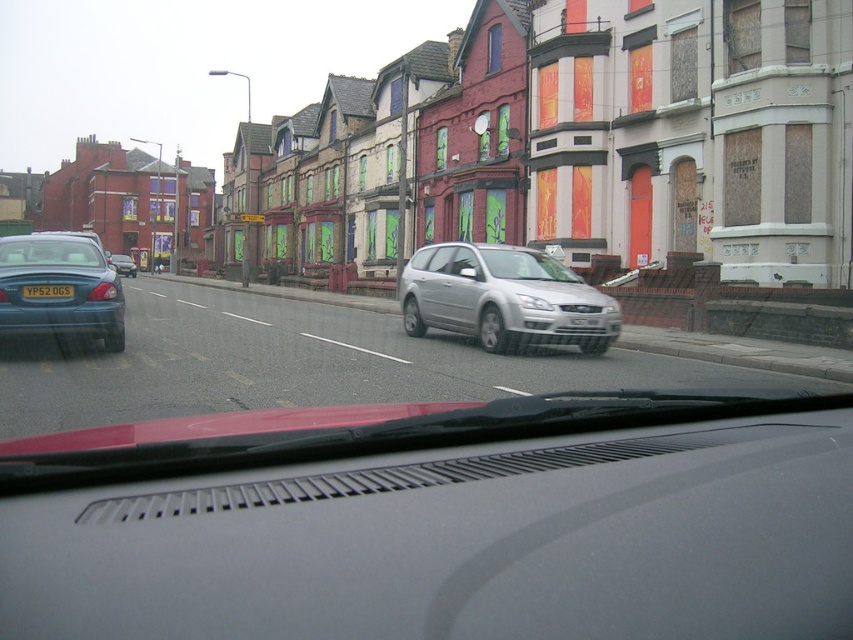
Question: Does gray matte dashboard at center appear on the left side of satin silver car at center?

Choices:
 (A) no
 (B) yes

Answer: (B)

Question: Which object is farther from the camera taking this photo?

Choices:
 (A) black plastic license plate at center
 (B) silver metallic station wagon at center

Answer: (B)

Question: Does black plastic license plate at center appear on the right side of metallic blue sedan at center?

Choices:
 (A) no
 (B) yes

Answer: (B)

Question: Which point is farther to the camera?

Choices:
 (A) (103, 324)
 (B) (67, 241)
 (C) (614, 326)
 (D) (543, 260)

Answer: (D)

Question: Among these objects, which one is farthest from the camera?

Choices:
 (A) satin silver car at center
 (B) gray matte dashboard at center

Answer: (A)

Question: Can you confirm if satin silver car at center is smaller than metallic blue sedan at center?

Choices:
 (A) yes
 (B) no

Answer: (A)